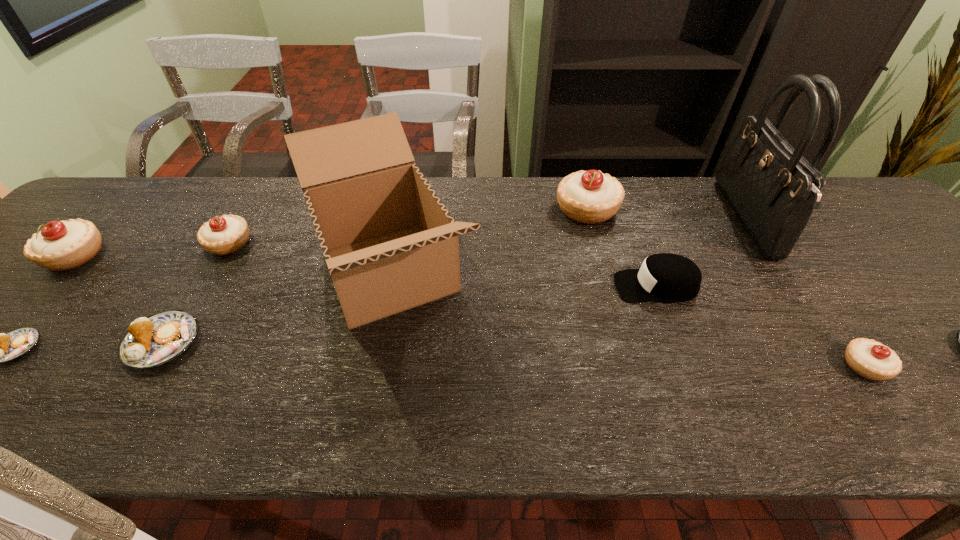
Locate which object is the sixth closest to the second smallest beige pastry. Please provide its 2D coordinates. Your answer should be formatted as a tuple, i.e. [(x, y)], where the tuple contains the x and y coordinates of a point satisfying the conditions above.

[(666, 277)]

Locate an element on the screen. The height and width of the screenshot is (540, 960). the fourth closest pastry to the rightmost object is located at coordinates point(221,235).

The height and width of the screenshot is (540, 960). Find the location of `the closest pastry to the sixth pastry from left to right`. the closest pastry to the sixth pastry from left to right is located at coordinates (959, 336).

Locate which beige pastry is the third closest to the tallest pastry. Please provide its 2D coordinates. Your answer should be formatted as a tuple, i.e. [(x, y)], where the tuple contains the x and y coordinates of a point satisfying the conditions above.

[(60, 245)]

Point out which beige pastry is positioned as the third nearest to the third biggest beige pastry. Please provide its 2D coordinates. Your answer should be formatted as a tuple, i.e. [(x, y)], where the tuple contains the x and y coordinates of a point satisfying the conditions above.

[(870, 359)]

At what (x,y) coordinates should I click in order to perform the action: click on the closest brown pastry relative to the leftmost brown pastry. Please return your answer as a coordinate pair (x, y). This screenshot has width=960, height=540. Looking at the image, I should click on (150, 342).

Locate an element on the screen. The width and height of the screenshot is (960, 540). the second closest brown pastry to the third tallest pastry is located at coordinates (0, 347).

The image size is (960, 540). I want to click on vacant point that satisfies the following two spatial constraints: 1. on the front-facing side of the black cap; 2. on the back side of the smallest beige pastry, so click(686, 366).

Identify the location of free region that satisfies the following two spatial constraints: 1. on the back side of the biggest brown pastry; 2. on the right side of the third biggest beige pastry. (224, 244).